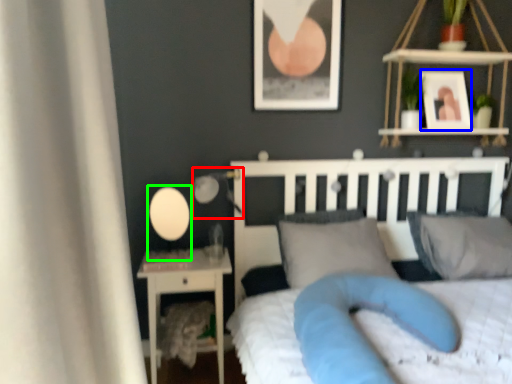
Question: Which is farther away from table lamp (highlighted by a red box)? picture frame (highlighted by a blue box) or table lamp (highlighted by a green box)?

Choices:
 (A) picture frame
 (B) table lamp

Answer: (A)